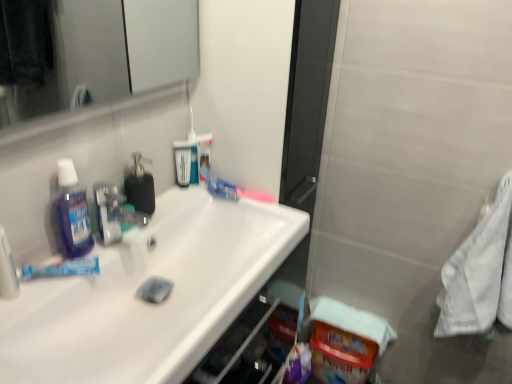
Locate an element on the screen. The image size is (512, 384). free spot behind black rubber soap dispenser at center is located at coordinates (177, 200).